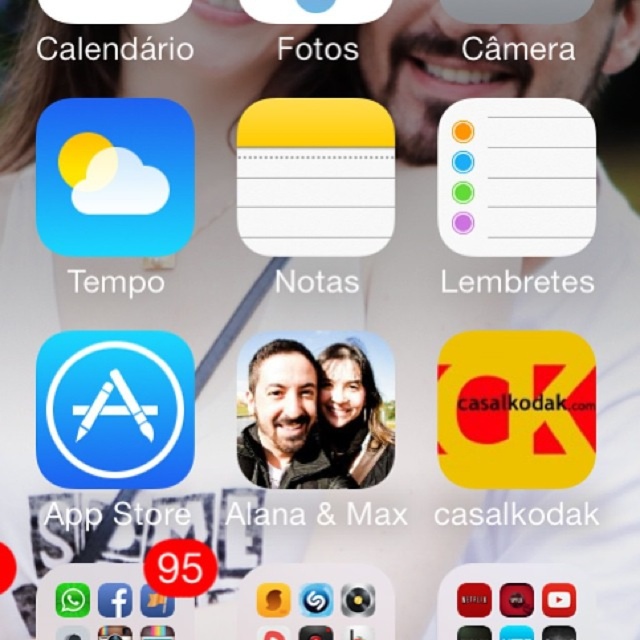
Question: Which point appears closest to the camera in this image?

Choices:
 (A) (273, 404)
 (B) (348, 369)

Answer: (B)

Question: Does matte black portrait at center have a greater width compared to smooth skin portrait at center?

Choices:
 (A) yes
 (B) no

Answer: (A)

Question: Does matte black portrait at center appear over smooth skin portrait at center?

Choices:
 (A) yes
 (B) no

Answer: (A)

Question: Which point is closer to the camera?

Choices:
 (A) smooth skin portrait at center
 (B) matte black portrait at center

Answer: (A)

Question: Can you confirm if matte black portrait at center is bigger than smooth skin portrait at center?

Choices:
 (A) no
 (B) yes

Answer: (B)

Question: Which point is farther to the camera?

Choices:
 (A) (282, 458)
 (B) (372, 468)

Answer: (A)